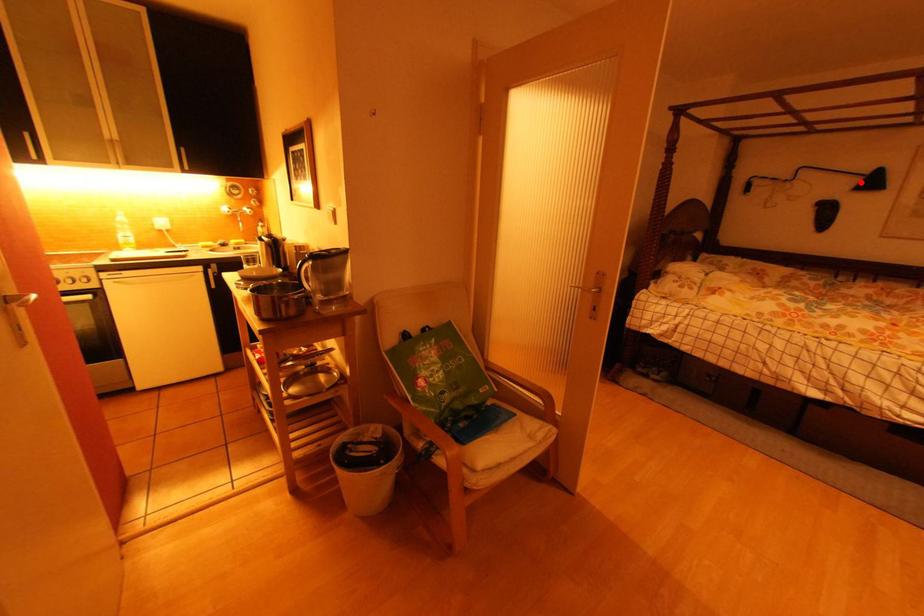
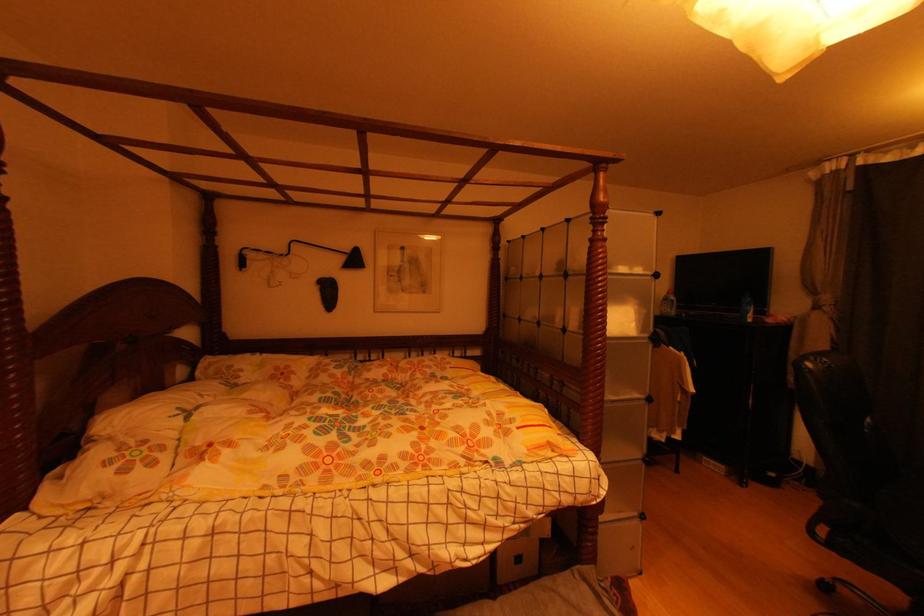
Find the pixel in the second image that matches the highlighted location in the first image.

(346, 261)